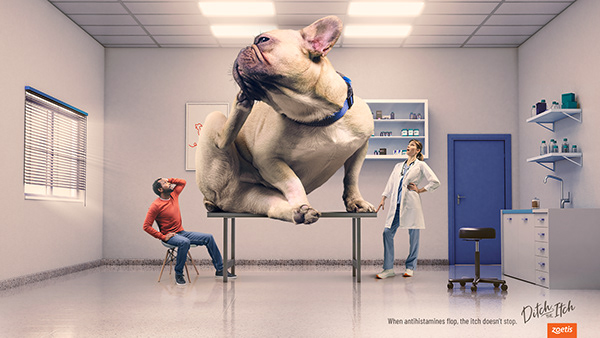
Where is `door`? door is located at coordinates (474, 184).